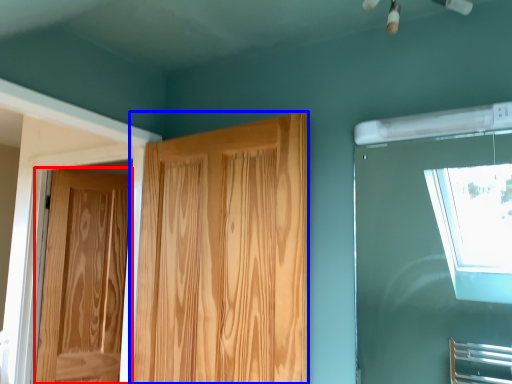
Question: Which of the following is the closest to the observer, door (highlighted by a red box) or door (highlighted by a blue box)?

Choices:
 (A) door
 (B) door

Answer: (B)